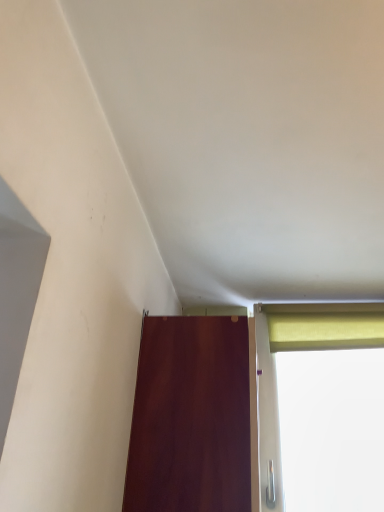
The width and height of the screenshot is (384, 512). What do you see at coordinates (325, 331) in the screenshot? I see `yellow fabric curtain at upper right` at bounding box center [325, 331].

Find the location of a particular element. Image resolution: width=384 pixels, height=512 pixels. yellow fabric curtain at upper right is located at coordinates (325, 331).

Measure the distance between mahogany wood door at lower center and camera.

A distance of 37.17 inches exists between mahogany wood door at lower center and camera.

The width and height of the screenshot is (384, 512). What do you see at coordinates (190, 417) in the screenshot? I see `mahogany wood door at lower center` at bounding box center [190, 417].

Identify the location of mahogany wood door at lower center. (190, 417).

You are a GUI agent. You are given a task and a screenshot of the screen. Output one action in this format:
    pyautogui.click(x=<x>, y=<y>)
    Task: Click on the yellow fabric curtain at upper right
    
    Given the screenshot: What is the action you would take?
    pyautogui.click(x=325, y=331)

Considering the relative positions of yellow fabric curtain at upper right and mahogany wood door at lower center in the image provided, is yellow fabric curtain at upper right to the left of mahogany wood door at lower center from the viewer's perspective?

No, yellow fabric curtain at upper right is not to the left of mahogany wood door at lower center.

Is the depth of yellow fabric curtain at upper right less than that of mahogany wood door at lower center?

No, the depth of yellow fabric curtain at upper right is greater than that of mahogany wood door at lower center.

Is point (336, 341) more distant than point (143, 399)?

Yes, it is behind point (143, 399).

From the image's perspective, does yellow fabric curtain at upper right appear lower than mahogany wood door at lower center?

No, from the image's perspective, yellow fabric curtain at upper right is not beneath mahogany wood door at lower center.

From the picture: From a real-world perspective, relative to mahogany wood door at lower center, is yellow fabric curtain at upper right vertically above or below?

yellow fabric curtain at upper right is situated higher than mahogany wood door at lower center in the real world.

Which object is thinner, yellow fabric curtain at upper right or mahogany wood door at lower center?

yellow fabric curtain at upper right is thinner.

From their relative heights in the image, would you say yellow fabric curtain at upper right is taller or shorter than mahogany wood door at lower center?

In the image, yellow fabric curtain at upper right appears to be shorter than mahogany wood door at lower center.

Considering the relative sizes of yellow fabric curtain at upper right and mahogany wood door at lower center in the image provided, is yellow fabric curtain at upper right bigger than mahogany wood door at lower center?

No, yellow fabric curtain at upper right is not bigger than mahogany wood door at lower center.

Which is correct: yellow fabric curtain at upper right is inside mahogany wood door at lower center, or outside of it?

yellow fabric curtain at upper right is not enclosed by mahogany wood door at lower center.

Based on the photo, are yellow fabric curtain at upper right and mahogany wood door at lower center beside each other?

No, yellow fabric curtain at upper right is not making contact with mahogany wood door at lower center.

Is yellow fabric curtain at upper right facing away from mahogany wood door at lower center?

No, yellow fabric curtain at upper right is not facing away from mahogany wood door at lower center.

What's the angular difference between yellow fabric curtain at upper right and mahogany wood door at lower center's facing directions?

There is a 90.1-degree angle between the facing directions of yellow fabric curtain at upper right and mahogany wood door at lower center.

Find the location of a particular element. This screenshot has width=384, height=512. curtain above the mahogany wood door at lower center (from a real-world perspective) is located at coordinates (325, 331).

Would you say mahogany wood door at lower center is to the left or to the right of yellow fabric curtain at upper right in the picture?

Clearly, mahogany wood door at lower center is on the left of yellow fabric curtain at upper right in the image.

Is the position of mahogany wood door at lower center more distant than that of yellow fabric curtain at upper right?

No, mahogany wood door at lower center is closer to the camera.

Considering the positions of point (169, 374) and point (369, 338), is point (169, 374) closer or farther from the camera than point (369, 338)?

Clearly, point (169, 374) is closer to the camera than point (369, 338).

Looking at this image, from the image's perspective, is mahogany wood door at lower center located beneath yellow fabric curtain at upper right?

Yes, from the image's perspective, mahogany wood door at lower center is beneath yellow fabric curtain at upper right.

From a real-world perspective, which object rests below the other?

mahogany wood door at lower center, from a real-world perspective.

Between mahogany wood door at lower center and yellow fabric curtain at upper right, which one has smaller width?

Thinner between the two is yellow fabric curtain at upper right.

Considering the sizes of objects mahogany wood door at lower center and yellow fabric curtain at upper right in the image provided, who is shorter, mahogany wood door at lower center or yellow fabric curtain at upper right?

With less height is yellow fabric curtain at upper right.

Considering the sizes of objects mahogany wood door at lower center and yellow fabric curtain at upper right in the image provided, who is bigger, mahogany wood door at lower center or yellow fabric curtain at upper right?

mahogany wood door at lower center is bigger.

Is mahogany wood door at lower center not within yellow fabric curtain at upper right?

Yes, mahogany wood door at lower center is located beyond the bounds of yellow fabric curtain at upper right.

Can you see mahogany wood door at lower center touching yellow fabric curtain at upper right?

mahogany wood door at lower center and yellow fabric curtain at upper right are not in contact.

Is mahogany wood door at lower center looking in the opposite direction of yellow fabric curtain at upper right?

That's not correct — mahogany wood door at lower center is not looking away from yellow fabric curtain at upper right.

What's the angular difference between mahogany wood door at lower center and yellow fabric curtain at upper right's facing directions?

The angular difference between mahogany wood door at lower center and yellow fabric curtain at upper right is 90.1 degrees.

The height and width of the screenshot is (512, 384). In order to click on curtain on the right of mahogany wood door at lower center in this screenshot , I will do `click(325, 331)`.

At what (x,y) coordinates should I click in order to perform the action: click on door that appears below the yellow fabric curtain at upper right (from a real-world perspective). Please return your answer as a coordinate pair (x, y). The width and height of the screenshot is (384, 512). Looking at the image, I should click on (190, 417).

Locate an element on the screen. The width and height of the screenshot is (384, 512). door below the yellow fabric curtain at upper right (from the image's perspective) is located at coordinates (190, 417).